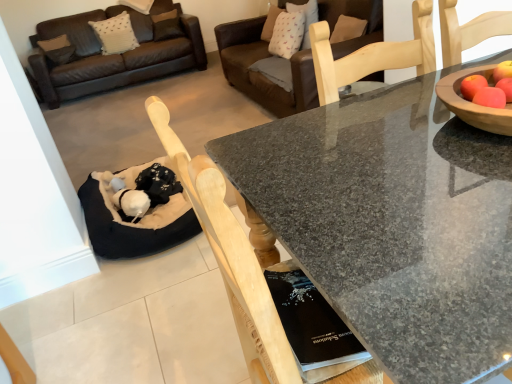
Describe the element at coordinates (133, 223) in the screenshot. I see `black fabric cat bed at lower left` at that location.

Image resolution: width=512 pixels, height=384 pixels. Identify the location of granite table at center. (393, 223).

What's the angular difference between black fabric cat bed at lower left and brown leather couch at upper center's facing directions?

The angle between the facing direction of black fabric cat bed at lower left and the facing direction of brown leather couch at upper center is 88.8 degrees.

Identify the location of cat bed on the left of brown leather couch at upper center. This screenshot has width=512, height=384. (133, 223).

Which object is thinner, black fabric cat bed at lower left or brown leather couch at upper center?

With smaller width is black fabric cat bed at lower left.

Can you confirm if black fabric cat bed at lower left is bigger than brown leather couch at upper center?

Incorrect, black fabric cat bed at lower left is not larger than brown leather couch at upper center.

Based on the photo, is brown leather couch at upper center far from granite table at center?

Yes, brown leather couch at upper center is far from granite table at center.

Which is behind, brown leather couch at upper center or granite table at center?

brown leather couch at upper center.

Can granite table at center be found inside brown leather couch at upper center?

Actually, granite table at center is outside brown leather couch at upper center.

Which of these two, brown leather couch at upper center or granite table at center, stands shorter?

granite table at center is shorter.

Considering the relative sizes of brown leather couch at upper center and black fabric cat bed at lower left in the image provided, is brown leather couch at upper center taller than black fabric cat bed at lower left?

Yes.

Is brown leather couch at upper center to the left of black fabric cat bed at lower left from the viewer's perspective?

Incorrect, brown leather couch at upper center is not on the left side of black fabric cat bed at lower left.

Does brown leather couch at upper center have a lesser width compared to black fabric cat bed at lower left?

In fact, brown leather couch at upper center might be wider than black fabric cat bed at lower left.

Does black fabric cat bed at lower left have a lesser width compared to granite table at center?

Correct, the width of black fabric cat bed at lower left is less than that of granite table at center.

Which is more to the left, black fabric cat bed at lower left or granite table at center?

black fabric cat bed at lower left.

Consider the image. Considering the sizes of objects black fabric cat bed at lower left and granite table at center in the image provided, who is shorter, black fabric cat bed at lower left or granite table at center?

Standing shorter between the two is black fabric cat bed at lower left.

Is black fabric cat bed at lower left far away from granite table at center?

Yes, black fabric cat bed at lower left is far from granite table at center.

Can you confirm if granite table at center is wider than brown leather couch at upper center?

Yes, granite table at center is wider than brown leather couch at upper center.

From the image's perspective, does granite table at center appear lower than brown leather couch at upper center?

Yes.

Is point (359, 216) closer to viewer compared to point (246, 66)?

That is True.

The image size is (512, 384). I want to click on coffee table that appears below the brown leather couch at upper center (from the image's perspective), so click(393, 223).

Considering the relative sizes of granite table at center and black fabric cat bed at lower left in the image provided, is granite table at center wider than black fabric cat bed at lower left?

Indeed, granite table at center has a greater width compared to black fabric cat bed at lower left.

Is granite table at center further to camera compared to black fabric cat bed at lower left?

No.

Locate an element on the screen. Image resolution: width=512 pixels, height=384 pixels. studio couch on the right of black fabric cat bed at lower left is located at coordinates (261, 72).

Where is `studio couch lying above the granite table at center (from the image's perspective)`? studio couch lying above the granite table at center (from the image's perspective) is located at coordinates (261, 72).

Looking at the image, which one is located closer to brown leather couch at upper center, granite table at center or black fabric cat bed at lower left?

Based on the image, black fabric cat bed at lower left appears to be nearer to brown leather couch at upper center.

Based on their spatial positions, is brown leather couch at upper center or granite table at center closer to black fabric cat bed at lower left?

granite table at center is positioned closer to the anchor black fabric cat bed at lower left.

Based on the photo, looking at the image, which one is located further to granite table at center, brown leather couch at upper center or black fabric cat bed at lower left?

brown leather couch at upper center lies further to granite table at center than the other object.

When comparing their distances from granite table at center, does black fabric cat bed at lower left or brown leather couch at upper center seem closer?

Based on the image, black fabric cat bed at lower left appears to be nearer to granite table at center.

From the image, which object appears to be nearer to brown leather couch at upper center, black fabric cat bed at lower left or granite table at center?

The object closer to brown leather couch at upper center is black fabric cat bed at lower left.

When comparing their distances from black fabric cat bed at lower left, does granite table at center or brown leather couch at upper center seem further?

brown leather couch at upper center is positioned further to the anchor black fabric cat bed at lower left.

Image resolution: width=512 pixels, height=384 pixels. I want to click on cat bed between granite table at center and brown leather couch at upper center along the z-axis, so click(x=133, y=223).